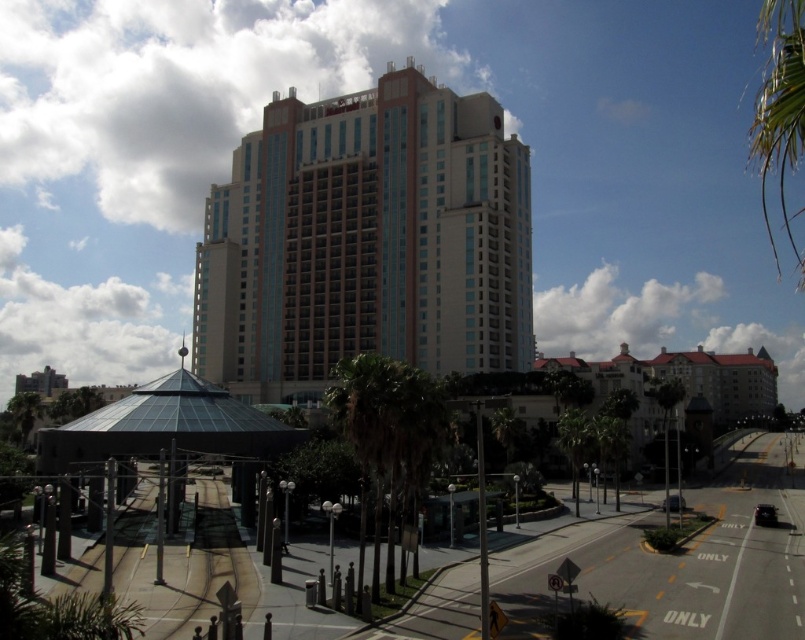
Is green leafy palm tree at center wider than green leafy palm tree at upper right?

No.

Between point (374, 580) and point (775, 35), which one is positioned behind?

Point (775, 35)

Is point (361, 372) farther from viewer compared to point (787, 241)?

No, (361, 372) is in front of (787, 241).

Locate an element on the screen. This screenshot has width=805, height=640. green leafy palm tree at center is located at coordinates 387,429.

Can you confirm if beige glass building at center is smaller than green leafy palm tree at upper right?

Yes, beige glass building at center is smaller than green leafy palm tree at upper right.

Can you confirm if beige glass building at center is taller than green leafy palm tree at upper right?

No.

Who is more distant from viewer, (x=267, y=161) or (x=786, y=234)?

Positioned behind is point (x=786, y=234).

The image size is (805, 640). Identify the location of beige glass building at center. (366, 241).

Who is positioned more to the right, beige glass building at center or green leafy palm tree at center?

From the viewer's perspective, green leafy palm tree at center appears more on the right side.

Is point (323, 384) positioned before point (366, 406)?

No, it is not.

Locate an element on the screen. beige glass building at center is located at coordinates (366, 241).